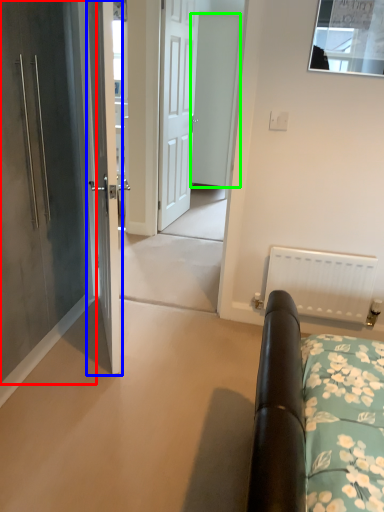
Question: Considering the real-world distances, which object is farthest from door (highlighted by a red box)? door (highlighted by a blue box) or door (highlighted by a green box)?

Choices:
 (A) door
 (B) door

Answer: (B)